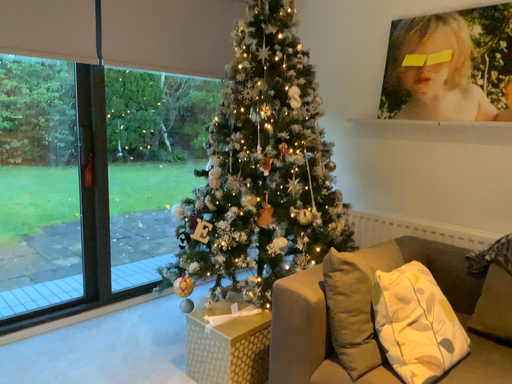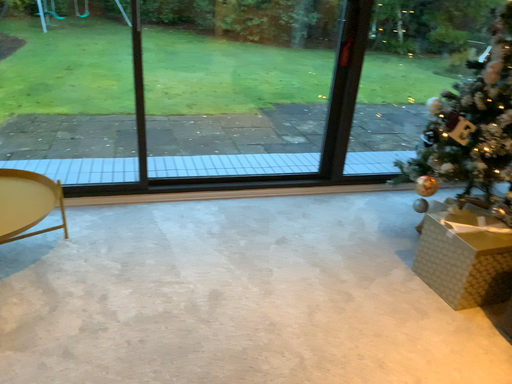
Question: Which way did the camera rotate in the video?

Choices:
 (A) rotated downward
 (B) rotated upward

Answer: (A)